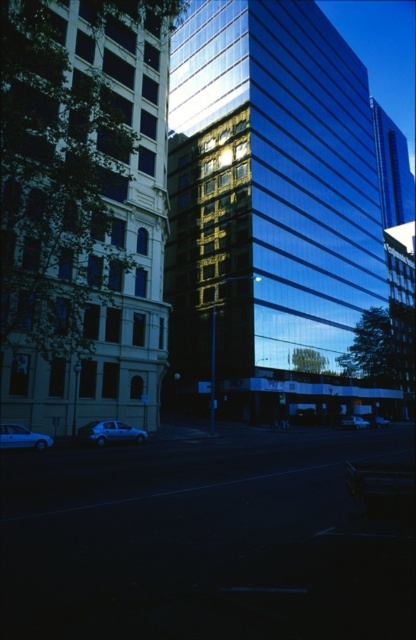
Question: Which object is farther from the camera taking this photo?

Choices:
 (A) silver metallic car at center
 (B) silver metallic car at lower left
 (C) white glossy car at lower left
 (D) smooth glass building at center

Answer: (A)

Question: Which of these objects is positioned farthest from the glossy glass tower at center?

Choices:
 (A) white glossy car at lower left
 (B) glossy glass building at upper right
 (C) metallic silver car at lower right

Answer: (B)

Question: Is silver metallic car at lower left bigger than white glossy car at lower left?

Choices:
 (A) no
 (B) yes

Answer: (B)

Question: Can you confirm if glossy glass tower at center is positioned above glossy glass building at upper right?

Choices:
 (A) yes
 (B) no

Answer: (B)

Question: Is glossy glass tower at center thinner than metallic silver car at lower right?

Choices:
 (A) no
 (B) yes

Answer: (A)

Question: Which object is positioned closest to the glossy glass tower at center?

Choices:
 (A) white glossy car at lower left
 (B) glossy glass building at upper right

Answer: (A)